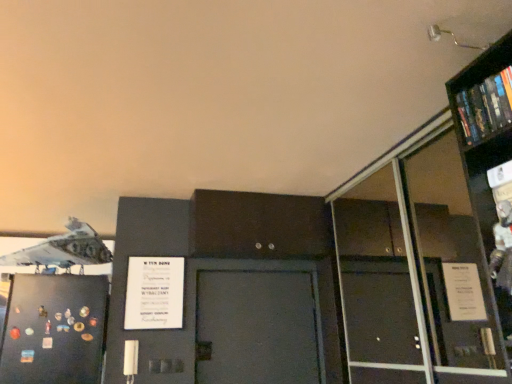
Question: Based on their sizes in the image, would you say white paper poster at center is bigger or smaller than transparent glass bookcase at upper right?

Choices:
 (A) small
 (B) big

Answer: (A)

Question: From a real-world perspective, is white paper poster at center above or below transparent glass bookcase at upper right?

Choices:
 (A) below
 (B) above

Answer: (A)

Question: Considering the real-world distances, which object is closest to the white paper poster at center?

Choices:
 (A) transparent glass bookcase at upper right
 (B) white matte airplane at upper left
 (C) black matte refrigerator at left
 (D) hardcover book at upper right

Answer: (C)

Question: Estimate the real-world distances between objects in this image. Which object is closer to the hardcover book at upper right?

Choices:
 (A) transparent glass bookcase at upper right
 (B) white matte airplane at upper left
 (C) black matte refrigerator at left
 (D) white paper poster at center

Answer: (A)